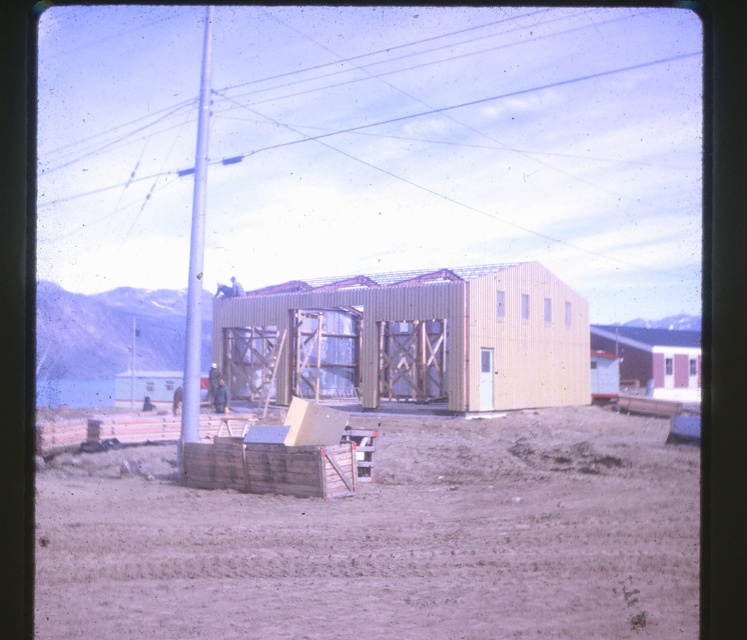
You are a delivery person who needs to drive a 2.5 meter wide truck through the space between the brown sandy dirt at lower center and the wooden cabin at center. Can the truck fit through this space?

The brown sandy dirt at lower center is to the left of the wooden cabin at center, but the distance between them isn not specified. Without knowing the exact width of the space, it is impossible to determine if the truck can fit through.

You are a construction worker who needs to determine where to place a heavy equipment. The equipment requires a flat area larger than the brown sandy dirt at lower center. Can the wooden cabin at center provide enough space?

The brown sandy dirt at lower center occupies less space than the wooden cabin at center. Therefore, the wooden cabin at center has more space and can accommodate the heavy equipment.